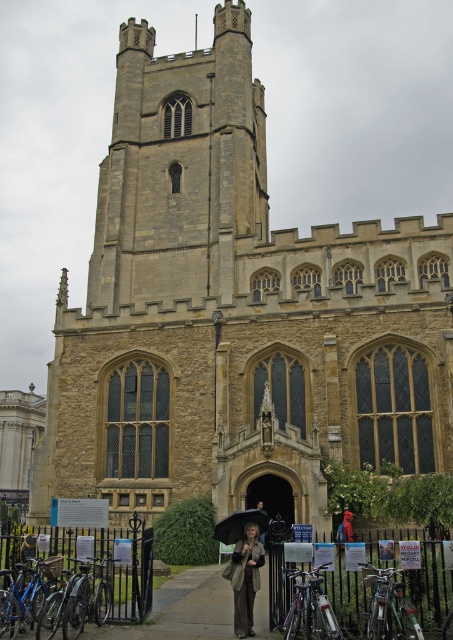
Question: Where is green matte bicycle at lower right located in relation to black matte umbrella at lower center in the image?

Choices:
 (A) below
 (B) above

Answer: (B)

Question: Can you confirm if blue matte bicycle at lower left is bigger than silver metallic bicycle at lower center?

Choices:
 (A) no
 (B) yes

Answer: (A)

Question: Among these objects, which one is nearest to the camera?

Choices:
 (A) blue matte bicycle at lower left
 (B) green matte bicycle at lower right

Answer: (B)

Question: In this image, where is black matte umbrella at lower center located relative to dark gray fabric umbrella at center?

Choices:
 (A) below
 (B) above

Answer: (B)

Question: Which of the following is the closest to the observer?

Choices:
 (A) (1, 634)
 (B) (250, 522)

Answer: (A)

Question: Which point is farther from the camera taking this photo?

Choices:
 (A) (409, 618)
 (B) (106, 572)
 (C) (43, 584)
 (D) (250, 561)

Answer: (B)